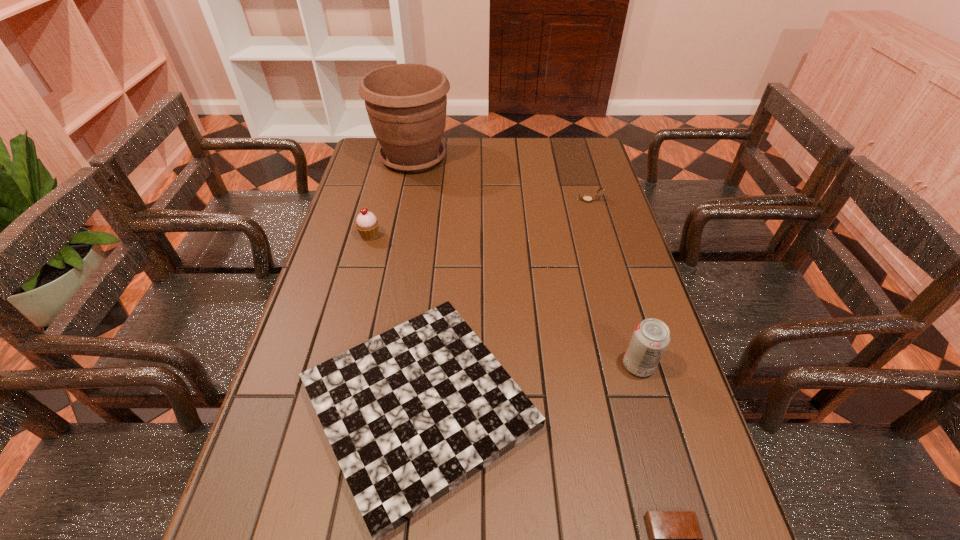
In the image, there is a desktop. In order to click on vacant area at the left edge in this screenshot , I will do `click(365, 193)`.

Locate an element on the screen. The image size is (960, 540). vacant region at the right edge of the desktop is located at coordinates click(x=640, y=477).

Identify the location of vacant space at the far right corner. (593, 139).

You are a GUI agent. You are given a task and a screenshot of the screen. Output one action in this format:
    pyautogui.click(x=<x>, y=<y>)
    Task: Click on the vacant area that lies between the soda can and the third farthest object
    The height and width of the screenshot is (540, 960).
    Given the screenshot: What is the action you would take?
    pyautogui.click(x=504, y=300)

The image size is (960, 540). I want to click on free space between the third tallest object and the soda can, so click(x=504, y=300).

At what (x,y) coordinates should I click in order to perform the action: click on unoccupied area between the compass and the soda can. Please return your answer as a coordinate pair (x, y). Image resolution: width=960 pixels, height=540 pixels. Looking at the image, I should click on (613, 282).

You are a GUI agent. You are given a task and a screenshot of the screen. Output one action in this format:
    pyautogui.click(x=<x>, y=<y>)
    Task: Click on the free area in between the fifth nearest object and the soda can
    This screenshot has height=540, width=960.
    Given the screenshot: What is the action you would take?
    pyautogui.click(x=613, y=282)

The image size is (960, 540). I want to click on free space that is in between the compass and the fifth shortest object, so click(x=613, y=282).

Locate an element on the screen. Image resolution: width=960 pixels, height=540 pixels. object identified as the closest to the shortest object is located at coordinates (411, 414).

Locate which object is the closest to the alarm clock. Please provide its 2D coordinates. Your answer should be formatted as a tuple, i.e. [(x, y)], where the tuple contains the x and y coordinates of a point satisfying the conditions above.

[(411, 414)]